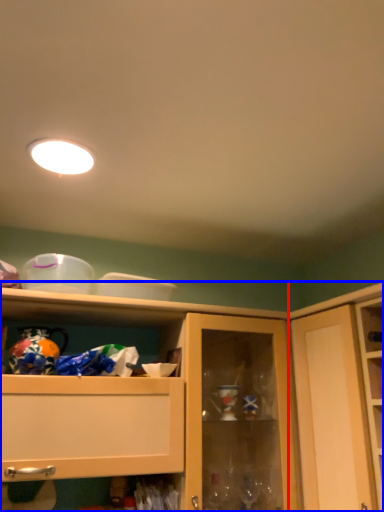
Question: Which object appears closest to the camera in this image, cupboard (highlighted by a red box) or cabinetry (highlighted by a blue box)?

Choices:
 (A) cupboard
 (B) cabinetry

Answer: (A)